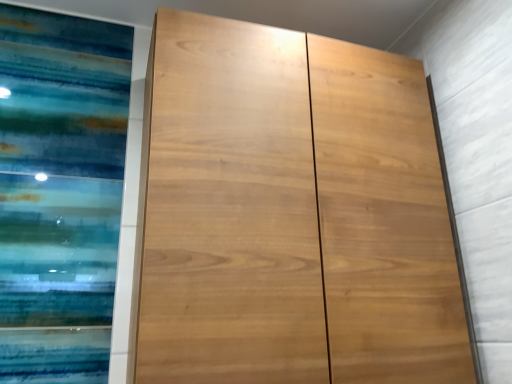
Image resolution: width=512 pixels, height=384 pixels. I want to click on light brown wood door at center, so click(x=293, y=214).

Describe the element at coordinates (293, 214) in the screenshot. Image resolution: width=512 pixels, height=384 pixels. I see `light brown wood door at center` at that location.

This screenshot has height=384, width=512. What are the coordinates of `light brown wood door at center` in the screenshot? It's located at (293, 214).